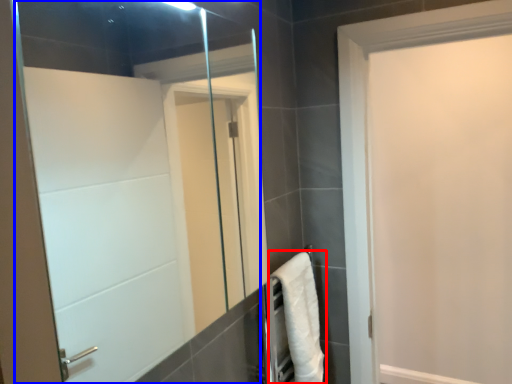
Question: Which point is further to the camera, bath towel (highlighted by a red box) or mirror (highlighted by a blue box)?

Choices:
 (A) bath towel
 (B) mirror

Answer: (A)